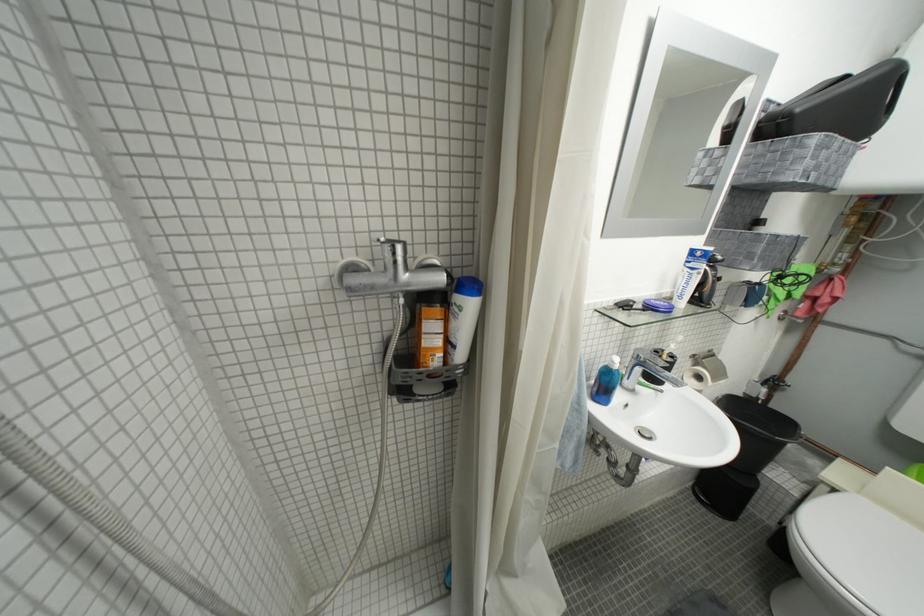
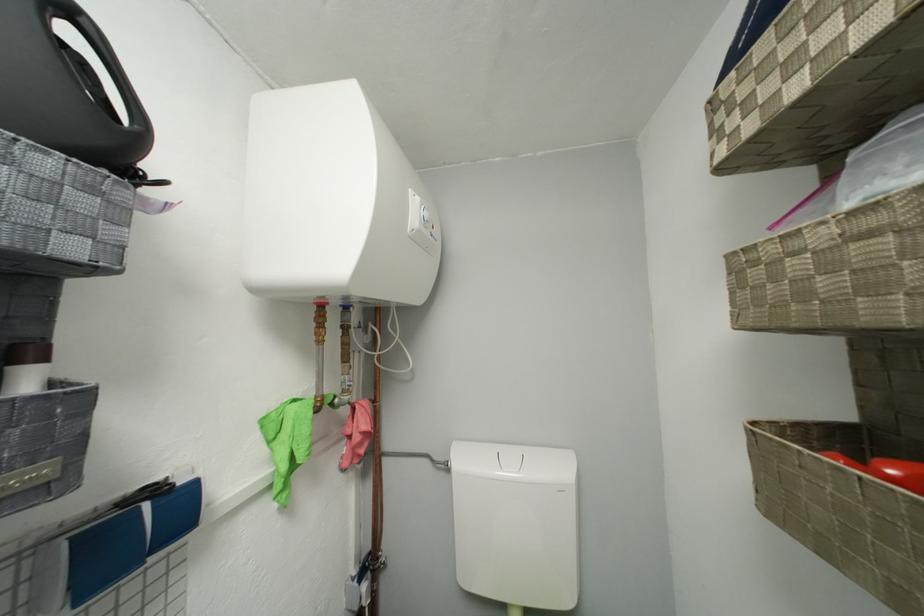
The point at (825, 297) is marked in the first image. Where is the corresponding point in the second image?

(358, 435)